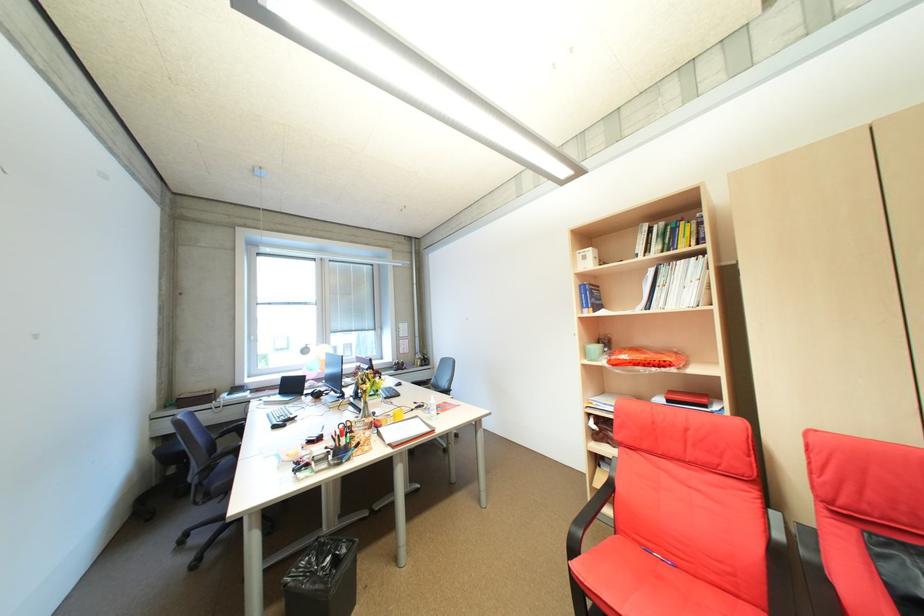
Locate an element on the screen. white telephone handset is located at coordinates (280, 416).